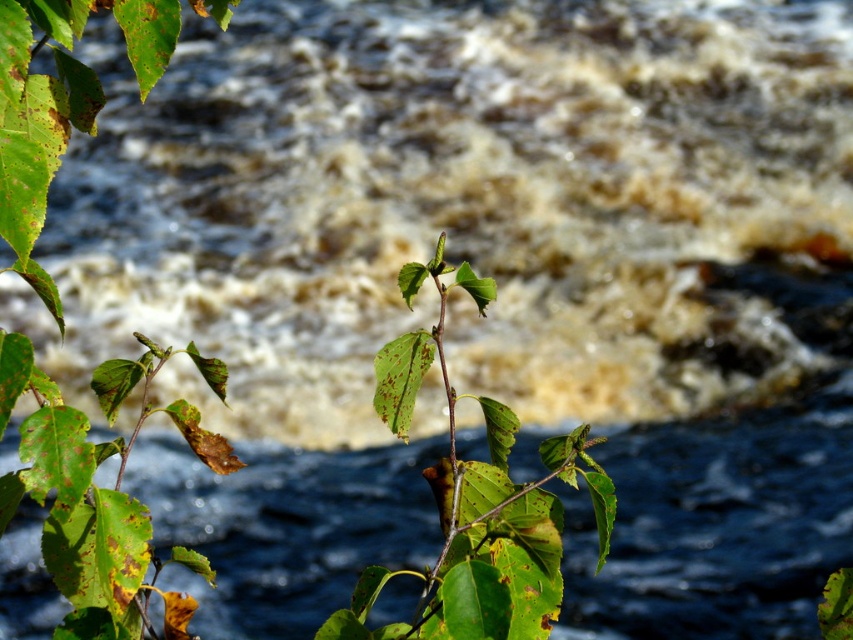
Is green matte leaves at left smaller than green matte leaf at center?

Actually, green matte leaves at left might be larger than green matte leaf at center.

Can you confirm if green matte leaves at left is wider than green matte leaf at center?

Yes.

Locate an element on the screen. This screenshot has width=853, height=640. green matte leaves at left is located at coordinates (80, 490).

This screenshot has height=640, width=853. Find the location of `green matte leaves at left`. green matte leaves at left is located at coordinates (80, 490).